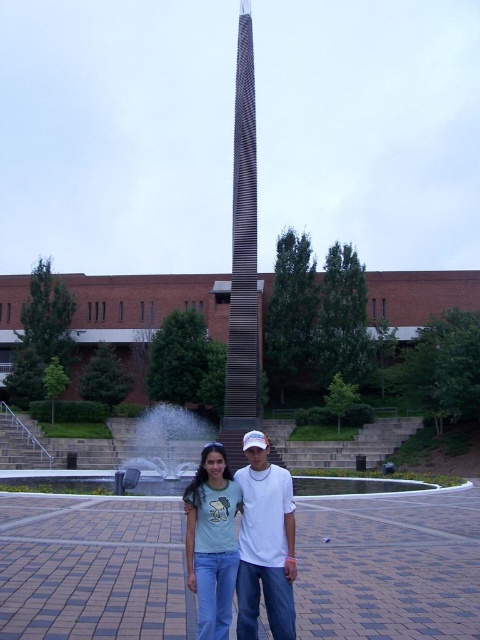
Can you confirm if light blue jeans at center is taller than light green cotton shirt at center?

No.

What do you see at coordinates (264, 541) in the screenshot? The height and width of the screenshot is (640, 480). I see `light blue jeans at center` at bounding box center [264, 541].

I want to click on light blue jeans at center, so click(264, 541).

Between carbon fiber tower at center and light green cotton shirt at center, which one is positioned higher?

carbon fiber tower at center

Which of these two, carbon fiber tower at center or light green cotton shirt at center, stands taller?

carbon fiber tower at center

Is point (256, 314) positioned before point (224, 468)?

No.

Locate an element on the screen. This screenshot has width=480, height=640. carbon fiber tower at center is located at coordinates (242, 246).

Is carbon fiber tower at center further to camera compared to white glossy water at center?

Yes, it is.

What do you see at coordinates (242, 246) in the screenshot? I see `carbon fiber tower at center` at bounding box center [242, 246].

Locate an element on the screen. carbon fiber tower at center is located at coordinates (242, 246).